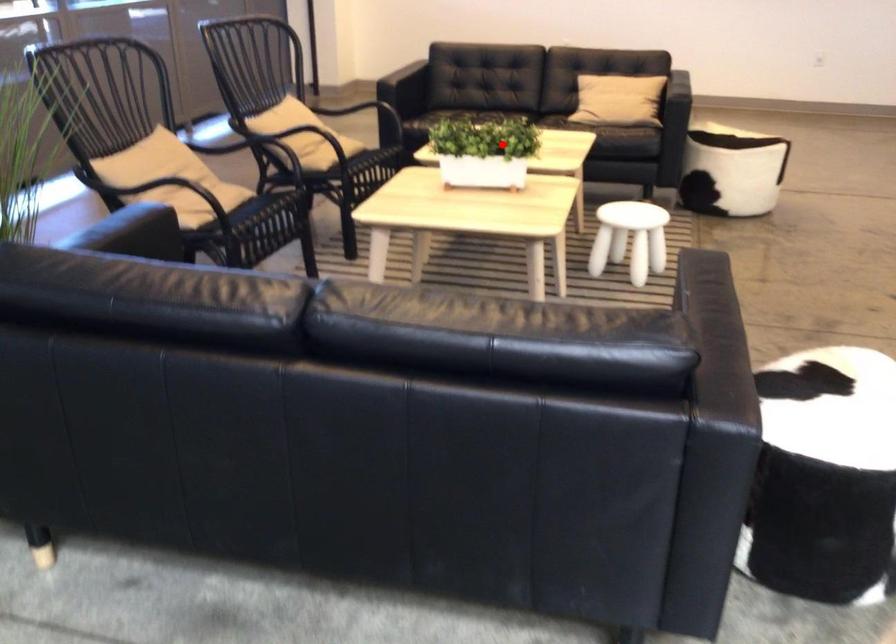
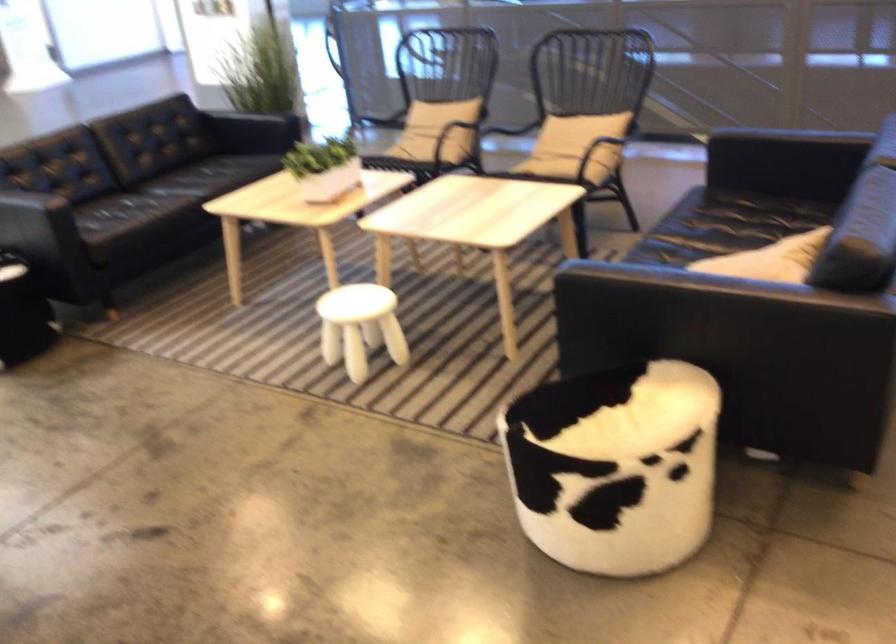
Question: I am providing you with two images of the same scene from different viewpoints. Given a red point in image1, look at the same physical point in image2. Is it:

Choices:
 (A) Closer to the viewpoint
 (B) Farther from the viewpoint

Answer: (B)